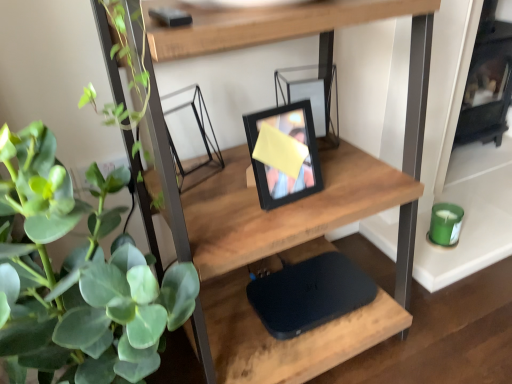
Identify the location of vacant space to the right of wooden shelf at center. Image resolution: width=512 pixels, height=384 pixels. (439, 316).